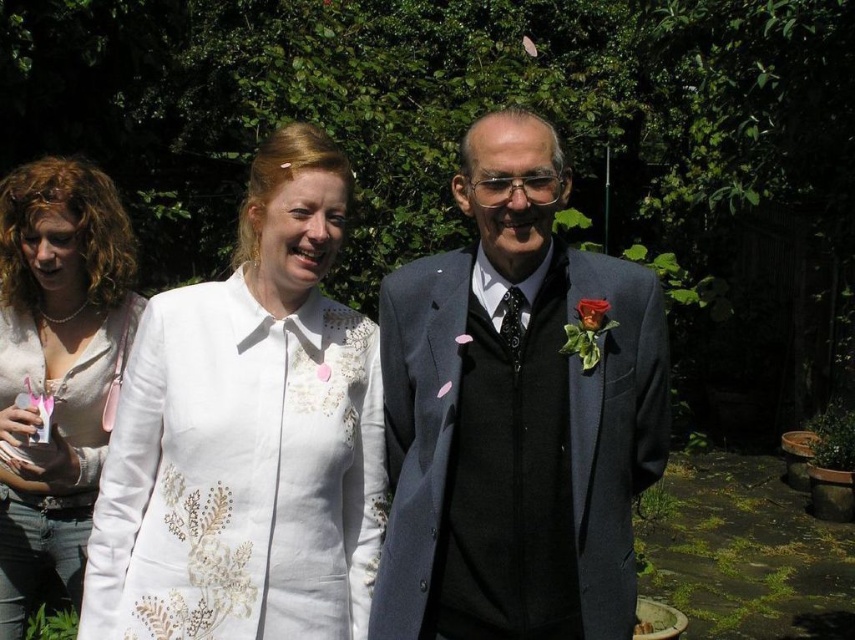
You are a photographer at a formal event and notice two white blouses in the scene. The first is the white embroidered blouse at center, and the second is the matte white blouse at center. Which of these blouses appears shorter in the image?

The white embroidered blouse at center has a lesser height compared to the matte white blouse at center, so the white embroidered blouse at center appears shorter.

Looking at this image, you are a photographer at a formal event. You need to adjust the lighting to ensure both the white textured coat at center and the matte gray suit at center are well illuminated. Considering their sizes, which one requires a wider light spread to cover its larger surface area?

The white textured coat at center requires a wider light spread because it has a larger size compared to the matte gray suit at center.

Based on the coordinates provided, which object is located at point (246, 435) in the image?

The point (246, 435) corresponds to the white embroidered blouse at center.